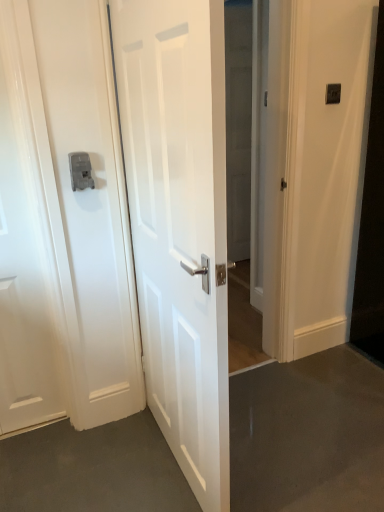
At what (x,y) coordinates should I click in order to perform the action: click on white glossy door at left, which is the 1th door in left-to-right order. Please return your answer as a coordinate pair (x, y). The height and width of the screenshot is (512, 384). Looking at the image, I should click on (25, 250).

What do you see at coordinates (179, 222) in the screenshot? I see `white glossy door at center, positioned as the 1th door in right-to-left order` at bounding box center [179, 222].

You are a GUI agent. You are given a task and a screenshot of the screen. Output one action in this format:
    pyautogui.click(x=<x>, y=<y>)
    Task: Click on the black plastic light switch at upper right
    
    Given the screenshot: What is the action you would take?
    pyautogui.click(x=333, y=93)

In order to face transparent glass door at center, should I rotate leftwards or rightwards?

To align with it, rotate right about 7.269°.

Image resolution: width=384 pixels, height=512 pixels. Describe the element at coordinates (80, 170) in the screenshot. I see `satin silver latch at left` at that location.

In order to click on white glossy door at left, arranged as the 2th door when viewed from the right in this screenshot , I will do `click(25, 250)`.

From the image's perspective, is white glossy door at center, positioned as the 1th door in right-to-left order, under satin silver latch at left?

Indeed, from the image's perspective, white glossy door at center, positioned as the 1th door in right-to-left order, is shown beneath satin silver latch at left.

Considering the sizes of objects white glossy door at center, the 2th door when ordered from left to right, and satin silver latch at left in the image provided, who is thinner, white glossy door at center, the 2th door when ordered from left to right, or satin silver latch at left?

Thinner between the two is satin silver latch at left.

From a real-world perspective, is white glossy door at center, positioned as the 1th door in right-to-left order, located beneath satin silver latch at left?

Indeed, from a real-world perspective, white glossy door at center, positioned as the 1th door in right-to-left order, is positioned beneath satin silver latch at left.

Could satin silver latch at left be considered to be inside white glossy door at center, positioned as the 1th door in right-to-left order?

No, white glossy door at center, positioned as the 1th door in right-to-left order, does not contain satin silver latch at left.

Does point (23, 366) appear closer or farther from the camera than point (78, 154)?

Point (23, 366) is positioned farther from the camera compared to point (78, 154).

Between white glossy door at left, which is the 1th door in left-to-right order, and satin silver latch at left, which one has larger size?

white glossy door at left, which is the 1th door in left-to-right order, is bigger.

Which object is further away from the camera, white glossy door at left, which is the 1th door in left-to-right order, or satin silver latch at left?

satin silver latch at left is behind.

In the image, is white glossy door at left, which is the 1th door in left-to-right order, on the left side or the right side of satin silver latch at left?

In the image, white glossy door at left, which is the 1th door in left-to-right order, appears on the left side of satin silver latch at left.

Would you say black plastic light switch at upper right is a long distance from satin silver latch at left?

Indeed, black plastic light switch at upper right is not near satin silver latch at left.

Is black plastic light switch at upper right closer to the viewer compared to satin silver latch at left?

No, black plastic light switch at upper right is further to the viewer.

Looking at this image, is black plastic light switch at upper right inside the boundaries of satin silver latch at left, or outside?

black plastic light switch at upper right is not inside satin silver latch at left, it's outside.

Can you tell me how much black plastic light switch at upper right and satin silver latch at left differ in facing direction?

The facing directions of black plastic light switch at upper right and satin silver latch at left are 0.00874 degrees apart.

Between transparent glass door at center and satin silver latch at left, which one has smaller size?

satin silver latch at left.

From the image's perspective, relative to satin silver latch at left, is transparent glass door at center above or below?

From the image's perspective, transparent glass door at center appears above satin silver latch at left.

Is transparent glass door at center located outside satin silver latch at left?

transparent glass door at center lies outside satin silver latch at left's area.

Based on the photo, is transparent glass door at center not close to satin silver latch at left?

transparent glass door at center is positioned a significant distance from satin silver latch at left.

What's the angular difference between black plastic light switch at upper right and transparent glass door at center's facing directions?

The facing directions of black plastic light switch at upper right and transparent glass door at center are 0.626 degrees apart.

Looking at this image, is black plastic light switch at upper right inside or outside of transparent glass door at center?

black plastic light switch at upper right is located beyond the bounds of transparent glass door at center.

Is black plastic light switch at upper right to the left or to the right of transparent glass door at center in the image?

black plastic light switch at upper right is to the right of transparent glass door at center.

Does white glossy door at center, the 2th door when ordered from left to right, have a lesser width compared to black plastic light switch at upper right?

Incorrect, the width of white glossy door at center, the 2th door when ordered from left to right, is not less than that of black plastic light switch at upper right.

Could you tell me if white glossy door at center, the 2th door when ordered from left to right, is turned towards black plastic light switch at upper right?

Yes, white glossy door at center, the 2th door when ordered from left to right, is oriented towards black plastic light switch at upper right.

Does point (213, 0) come in front of point (334, 88)?

Yes.

Can you confirm if white glossy door at center, the 2th door when ordered from left to right, is smaller than black plastic light switch at upper right?

No.

Which object is more forward, satin silver latch at left or white glossy door at center, the 2th door when ordered from left to right?

white glossy door at center, the 2th door when ordered from left to right, is in front.

Considering the sizes of objects satin silver latch at left and white glossy door at center, the 2th door when ordered from left to right, in the image provided, who is shorter, satin silver latch at left or white glossy door at center, the 2th door when ordered from left to right,?

Standing shorter between the two is satin silver latch at left.

Is satin silver latch at left looking in the opposite direction of white glossy door at center, the 2th door when ordered from left to right?

No, satin silver latch at left is not facing the opposite direction of white glossy door at center, the 2th door when ordered from left to right.

Between point (92, 186) and point (175, 22), which one is positioned behind?

Positioned behind is point (92, 186).

The width and height of the screenshot is (384, 512). Find the location of `door on the right of satin silver latch at left`. door on the right of satin silver latch at left is located at coordinates (179, 222).

Where is `the 2nd door directly beneath the satin silver latch at left (from a real-world perspective)`? the 2nd door directly beneath the satin silver latch at left (from a real-world perspective) is located at coordinates (25, 250).

Consider the image. From the image, which object appears to be nearer to transparent glass door at center, white glossy door at center, positioned as the 1th door in right-to-left order, or satin silver latch at left?

white glossy door at center, positioned as the 1th door in right-to-left order, lies closer to transparent glass door at center than the other object.

Looking at the image, which one is located further to white glossy door at center, positioned as the 1th door in right-to-left order, black plastic light switch at upper right or transparent glass door at center?

The object further to white glossy door at center, positioned as the 1th door in right-to-left order, is black plastic light switch at upper right.

Based on their spatial positions, is satin silver latch at left or transparent glass door at center closer to white glossy door at left, arranged as the 2th door when viewed from the right?

satin silver latch at left.

Estimate the real-world distances between objects in this image. Which object is closer to white glossy door at left, which is the 1th door in left-to-right order, transparent glass door at center or satin silver latch at left?

satin silver latch at left is closer to white glossy door at left, which is the 1th door in left-to-right order.

Looking at the image, which one is located further to black plastic light switch at upper right, satin silver latch at left or transparent glass door at center?

Based on the image, satin silver latch at left appears to be further to black plastic light switch at upper right.

Based on their spatial positions, is white glossy door at center, positioned as the 1th door in right-to-left order, or satin silver latch at left closer to black plastic light switch at upper right?

satin silver latch at left.

Which object lies further to the anchor point white glossy door at center, positioned as the 1th door in right-to-left order, transparent glass door at center or satin silver latch at left?

transparent glass door at center.

Which object lies nearer to the anchor point black plastic light switch at upper right, white glossy door at left, arranged as the 2th door when viewed from the right, or satin silver latch at left?

satin silver latch at left.

Identify the location of light switch between white glossy door at left, which is the 1th door in left-to-right order, and transparent glass door at center in the front-back direction. (333, 93).

The height and width of the screenshot is (512, 384). Identify the location of door between white glossy door at center, the 2th door when ordered from left to right, and transparent glass door at center, along the z-axis. (25, 250).

Where is `door positioned between white glossy door at center, the 2th door when ordered from left to right, and satin silver latch at left from near to far`? The image size is (384, 512). door positioned between white glossy door at center, the 2th door when ordered from left to right, and satin silver latch at left from near to far is located at coordinates (25, 250).

I want to click on latch between white glossy door at center, the 2th door when ordered from left to right, and transparent glass door at center, along the z-axis, so pos(80,170).